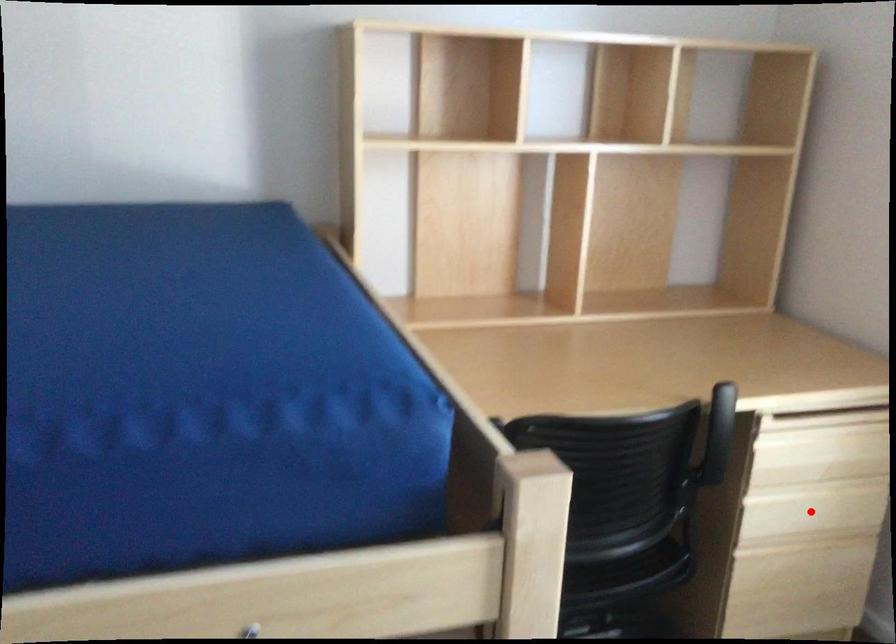
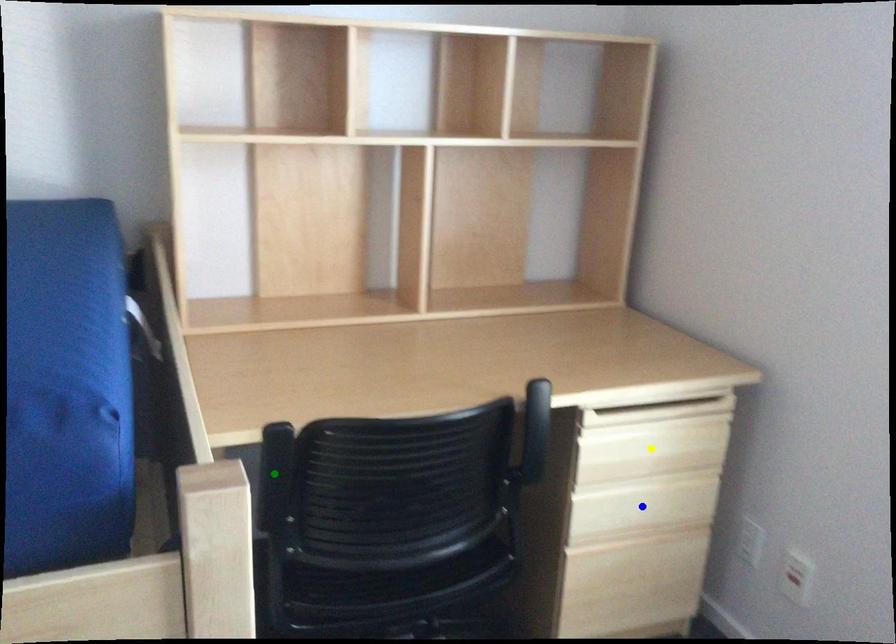
Question: I am providing you with two images of the same scene from different viewpoints. A red point is marked on the first image. You are given multiple points on the second image. Which point in image 2 represents the same 3d spot as the red point in image 1?

Choices:
 (A) blue point
 (B) yellow point
 (C) green point

Answer: (A)